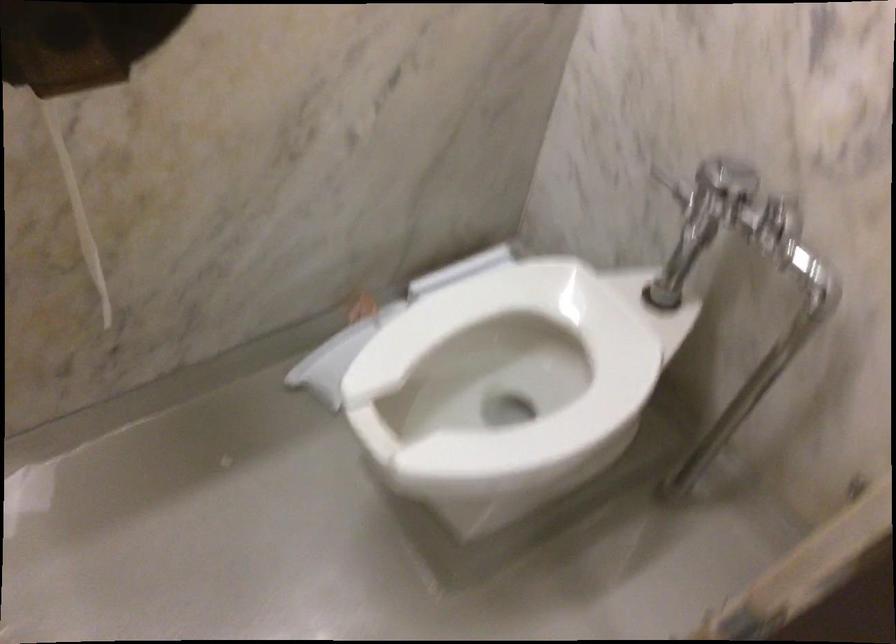
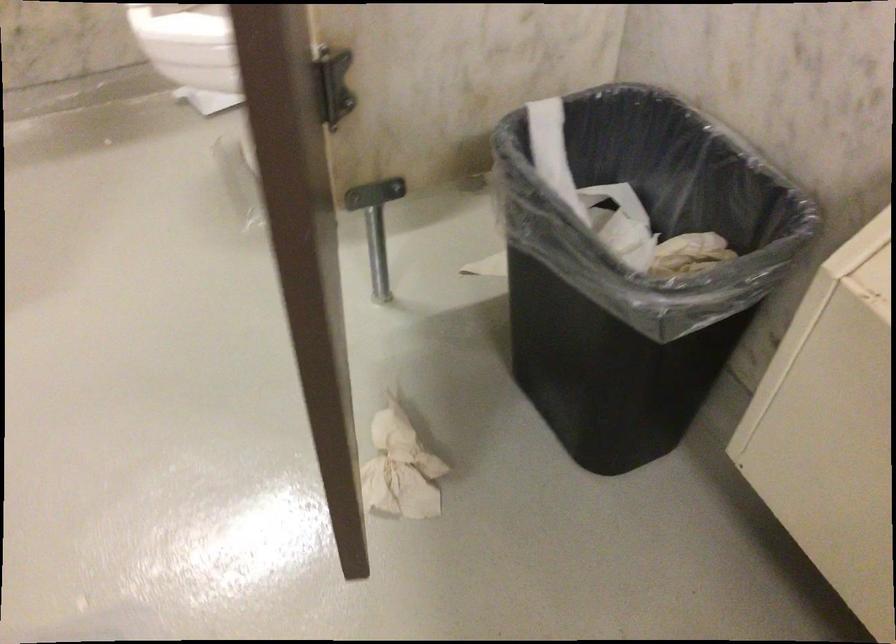
Question: The images are taken continuously from a first-person perspective. In which direction are you moving?

Choices:
 (A) Left
 (B) Right
 (C) Forward
 (D) Backward

Answer: (B)